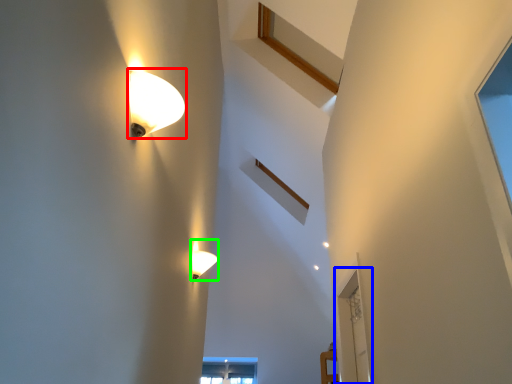
Question: Which is farther away from lamp (highlighted by a red box)? glass door (highlighted by a blue box) or lamp (highlighted by a green box)?

Choices:
 (A) glass door
 (B) lamp

Answer: (A)